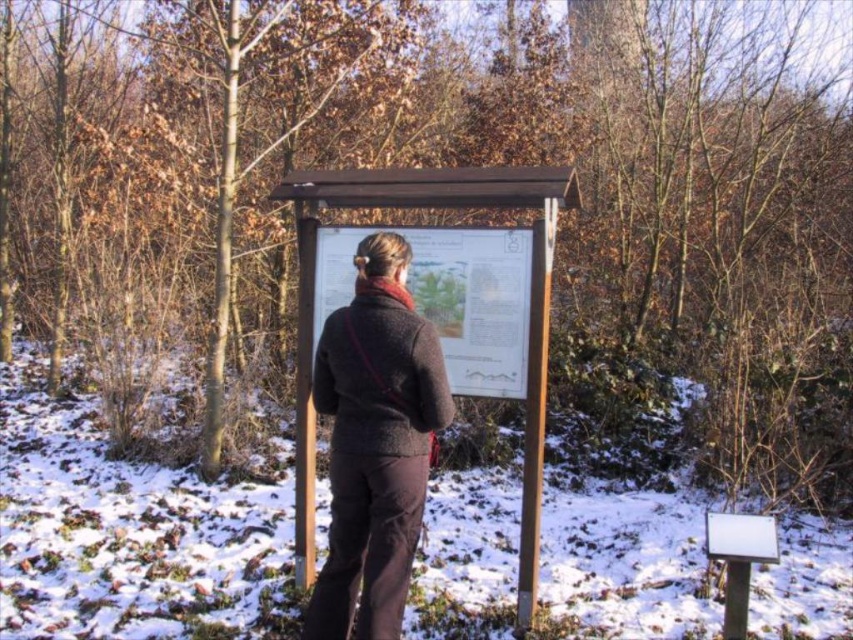
Can you confirm if white powdery snow at center is positioned above wooden sign at center?

No, white powdery snow at center is not above wooden sign at center.

What do you see at coordinates (131, 534) in the screenshot? I see `white powdery snow at center` at bounding box center [131, 534].

The image size is (853, 640). In order to click on white powdery snow at center in this screenshot , I will do `click(131, 534)`.

Where is `white powdery snow at center`? The width and height of the screenshot is (853, 640). white powdery snow at center is located at coordinates (131, 534).

Who is shorter, white powdery snow at center or brown woolen sweater at center?

With less height is white powdery snow at center.

Between point (184, 509) and point (335, 486), which one is positioned behind?

Positioned behind is point (184, 509).

You are a GUI agent. You are given a task and a screenshot of the screen. Output one action in this format:
    pyautogui.click(x=<x>, y=<y>)
    Task: Click on the white powdery snow at center
    
    Given the screenshot: What is the action you would take?
    pyautogui.click(x=131, y=534)

Does wooden sign at center appear on the left side of brown woolen sweater at center?

In fact, wooden sign at center is to the right of brown woolen sweater at center.

Between wooden sign at center and brown woolen sweater at center, which one appears on the right side from the viewer's perspective?

wooden sign at center

Locate an element on the screen. The image size is (853, 640). wooden sign at center is located at coordinates (440, 305).